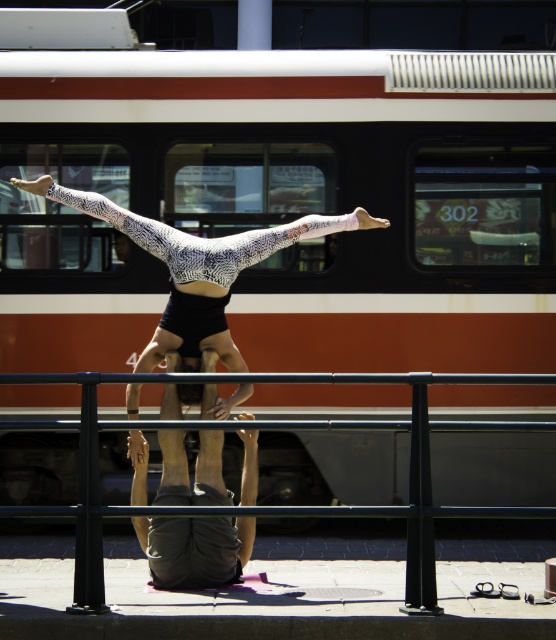
You are an observer standing at the train station platform. You see the black metal rail at center and the dark gray fabric pants at center. Which object is nearer to you?

The black metal rail at center is closer to the viewer than the dark gray fabric pants at center.